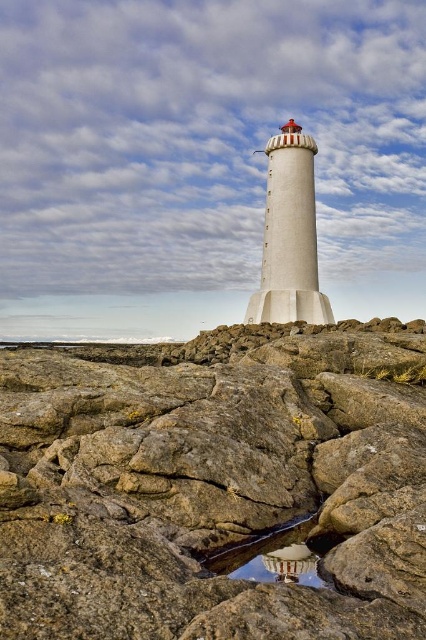
You are a painter setting up your easel to capture the lighthouse scene. You want to ensure that both the brown rough rock at center and the transparent glass puddle at center are clearly visible in your painting. Which object should you position closer to the foreground to emphasize its presence?

The brown rough rock at center should be positioned closer to the foreground because it might be wider than the transparent glass puddle at center, making it more prominent in the painting.

You are standing at the base of the lighthouse and see the point marked at coordinates (213, 483). What object is located at that point?

The point at coordinates (213, 483) corresponds to the brown rough rock at center.

You are a maintenance worker needing to reach the brown rough rock at center from the transparent glass puddle at center. Given that your equipment can only carry items up to 20 meters, can you safely transport materials between these two points?

The distance between the brown rough rock at center and the transparent glass puddle at center is 21.07 meters, which exceeds the equipment capacity of 20 meters. Therefore, you cannot safely transport materials between them.